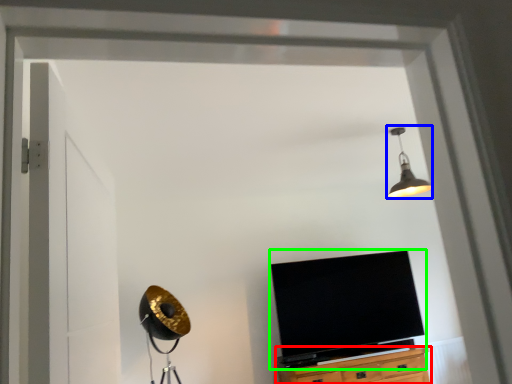
Question: Which object is positioned closest to cabinetry (highlighted by a red box)? Select from light fixture (highlighted by a blue box) and television (highlighted by a green box).

Choices:
 (A) light fixture
 (B) television

Answer: (B)